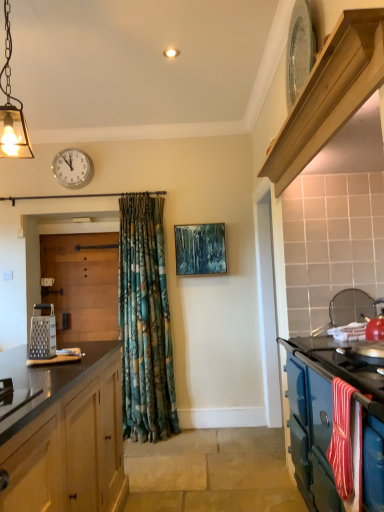
Question: Are metallic grater at left and light wood/texture shelf at upper right located far from each other?

Choices:
 (A) yes
 (B) no

Answer: (A)

Question: From the image's perspective, is metallic grater at left below light wood/texture shelf at upper right?

Choices:
 (A) yes
 (B) no

Answer: (A)

Question: From a real-world perspective, is metallic grater at left positioned under light wood/texture shelf at upper right based on gravity?

Choices:
 (A) yes
 (B) no

Answer: (A)

Question: Is light wood/texture shelf at upper right a part of metallic grater at left?

Choices:
 (A) no
 (B) yes

Answer: (A)

Question: Is metallic grater at left at the left side of light wood/texture shelf at upper right?

Choices:
 (A) no
 (B) yes

Answer: (B)

Question: Relative to blue enamel stove at right, is wooden door at left in front or behind?

Choices:
 (A) behind
 (B) front

Answer: (A)

Question: From a real-world perspective, is wooden door at left positioned above or below blue enamel stove at right?

Choices:
 (A) below
 (B) above

Answer: (B)

Question: From the image's perspective, is wooden door at left positioned above or below blue enamel stove at right?

Choices:
 (A) above
 (B) below

Answer: (A)

Question: Is wooden door at left taller or shorter than blue enamel stove at right?

Choices:
 (A) short
 (B) tall

Answer: (B)

Question: From their relative heights in the image, would you say white glossy clock at upper center is taller or shorter than light wood/texture shelf at upper right?

Choices:
 (A) tall
 (B) short

Answer: (A)

Question: Would you say white glossy clock at upper center is to the left or to the right of light wood/texture shelf at upper right in the picture?

Choices:
 (A) right
 (B) left

Answer: (B)

Question: Considering the positions of point (82, 169) and point (294, 139), is point (82, 169) closer or farther from the camera than point (294, 139)?

Choices:
 (A) closer
 (B) farther

Answer: (B)

Question: From a real-world perspective, is white glossy clock at upper center above or below light wood/texture shelf at upper right?

Choices:
 (A) below
 (B) above

Answer: (B)

Question: In the image, is light wood/texture shelf at upper right on the left side or the right side of blue enamel stove at right?

Choices:
 (A) right
 (B) left

Answer: (B)

Question: From a real-world perspective, is light wood/texture shelf at upper right positioned above or below blue enamel stove at right?

Choices:
 (A) above
 (B) below

Answer: (A)